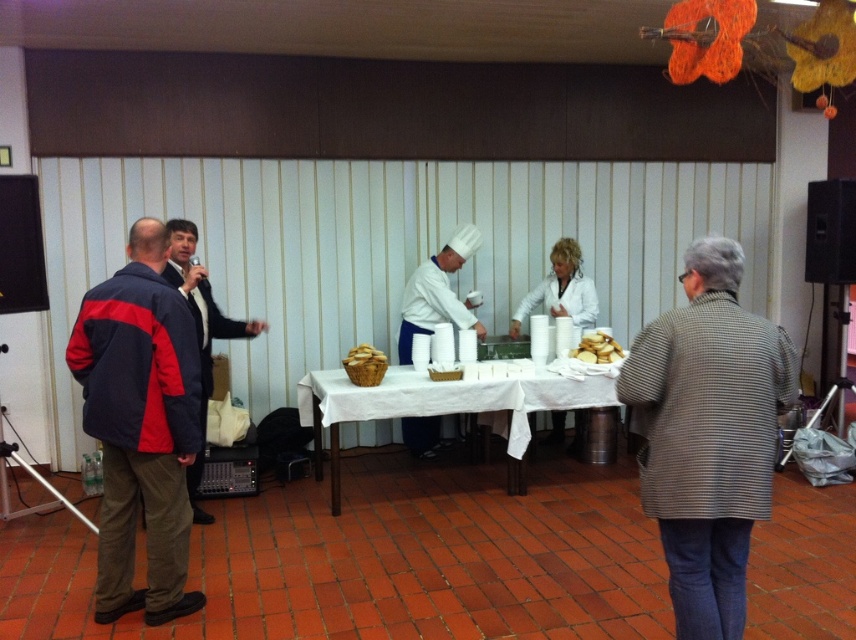
Question: Estimate the real-world distances between objects in this image. Which object is closer to the striped wool coat at lower right?

Choices:
 (A) red and navy blue jacket at left
 (B) white matte chef hat at center
 (C) golden brown wicker basket at center
 (D) white cloth-covered table at center

Answer: (A)

Question: Which of these objects is positioned farthest from the white cloth-covered table at center?

Choices:
 (A) red and navy blue jacket at left
 (B) golden brown crumbly biscuit at center
 (C) matte black jacket at left
 (D) golden brown wicker basket at center

Answer: (A)

Question: Is red and navy blue jacket at left wider than golden brown crumbly biscuit at center?

Choices:
 (A) no
 (B) yes

Answer: (B)

Question: Does white cloth-covered table at center lie behind golden brown crumbly biscuit at center?

Choices:
 (A) yes
 (B) no

Answer: (B)

Question: Is the position of white cloth-covered table at center more distant than that of white matte chef hat at center?

Choices:
 (A) no
 (B) yes

Answer: (A)

Question: Which of the following is the closest to the observer?

Choices:
 (A) striped wool coat at lower right
 (B) white cloth-covered table at center

Answer: (A)